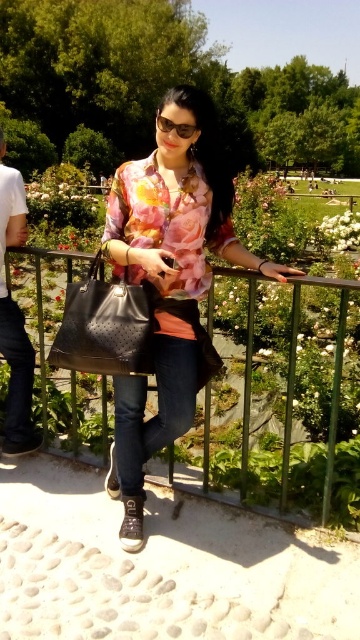
Based on the photo, you are a painter standing in the park. You want to paint the green metal fence at center and the white cotton shirt at left. Which object is shorter?

The green metal fence at center is shorter than the white cotton shirt at left.

You are standing at the center of the image and want to locate the green metal fence at center. Which direction should you look to find it?

The green metal fence at center is located at point 0.608 on the x axis and 0.922 on the y axis, so you should look towards the bottom right of the image.